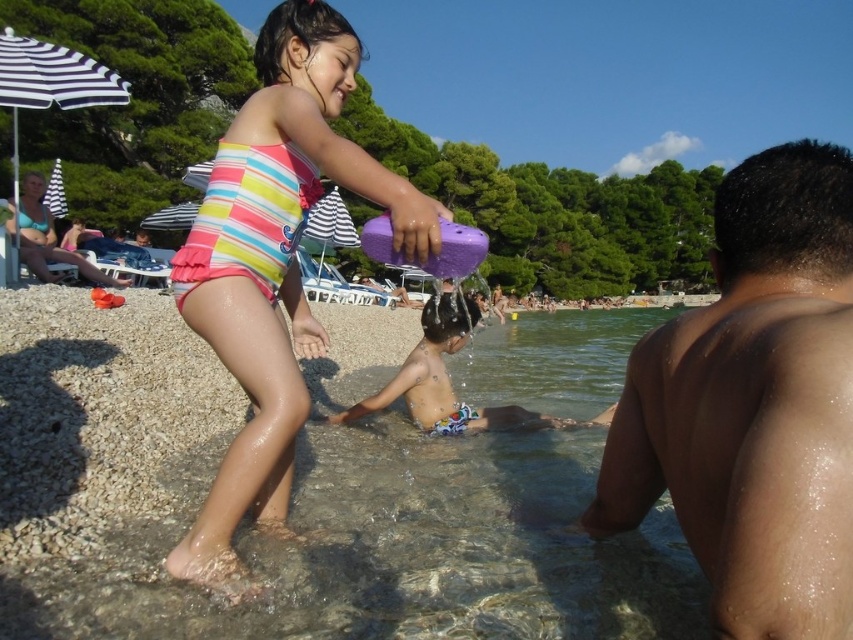
You are a photographer trying to capture a candid shot of the clear water at lower center and the multicolored swim trunks at lower center. Based on their positions, which object should you focus on first to ensure both are in the frame?

The clear water at lower center is in front of the multicolored swim trunks at lower center, so you should focus on the multicolored swim trunks at lower center first to ensure both are in the frame.

You are a photographer trying to capture the perfect shot of the shiny wet skin at lower right and the multicolored swim trunks at lower center. Which object should you focus on first if you want to ensure both are in the frame without moving the camera?

The shiny wet skin at lower right should be focused on first because it is shorter than the multicolored swim trunks at lower center, allowing the photographer to adjust the framing to include both.

You are a photographer trying to capture the clear water at lower center and the shiny wet skin at lower right in the same frame. Which object will occupy more space in your photo?

The clear water at lower center is bigger than the shiny wet skin at lower right, so it will occupy more space in the photo.